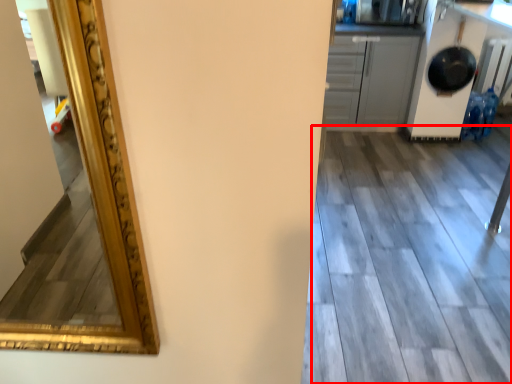
Question: Observing the image, what is the correct spatial positioning of tile (annotated by the red box) in reference to cabinetry?

Choices:
 (A) right
 (B) left

Answer: (A)